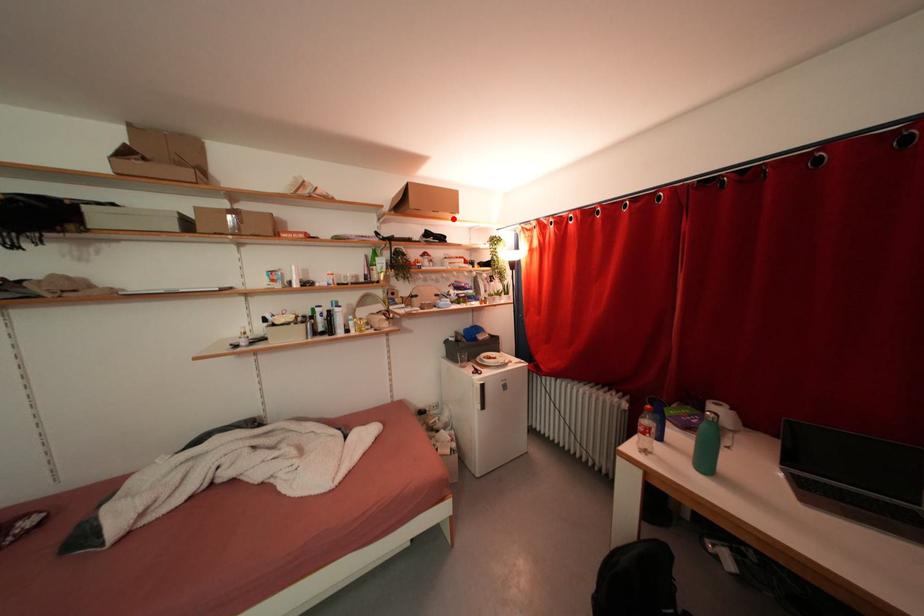
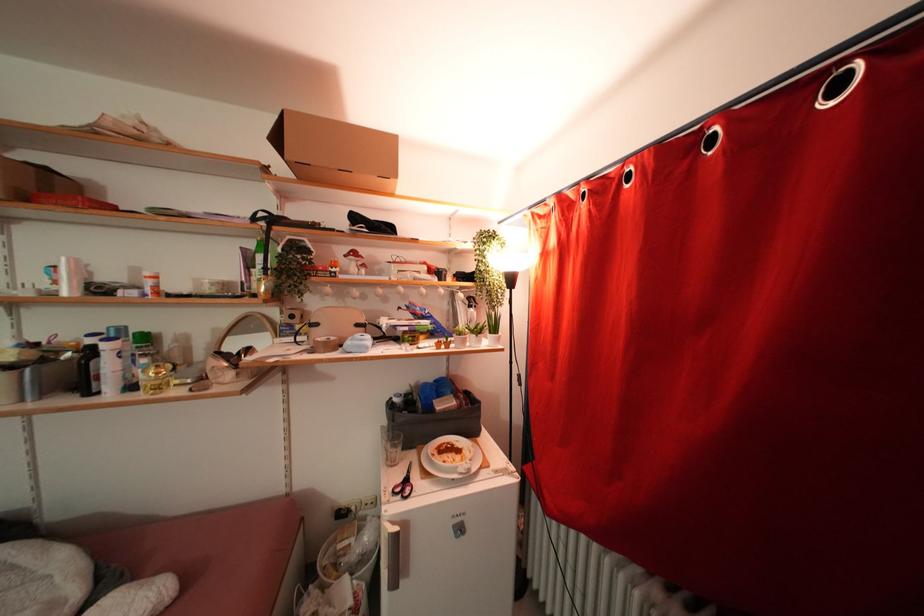
In the second image, find the point that corresponds to the highlighted location in the first image.

(381, 184)